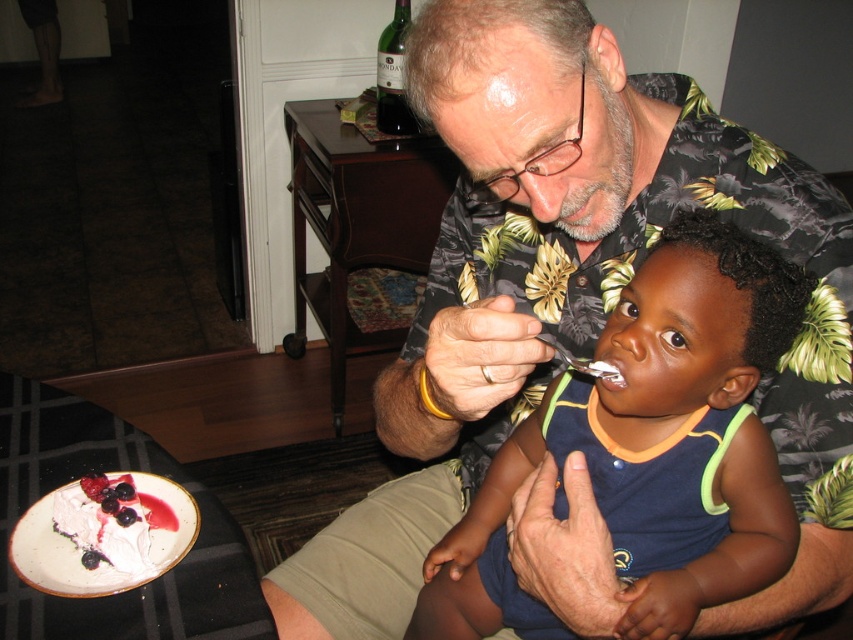
You are standing in front of a scene where an older man is feeding a child wearing a matte blue shirt at center. The man is sitting and the child is in his lap. If you want to place a small toy between them so that it is closer to the child than the man, where should you place it?

To place the small toy closer to the child wearing the matte blue shirt at center than the man, you should position it near the matte blue shirt at center.

You are a photographer taking a picture of the scene. The focus point is set to point (572, 298). Based on the scene description, what object is the focus point on?

The focus point at point (572, 298) is on the floral shirt at center.

What is the color of the shirt worn by the person at the coordinates point (648, 449)?

The color of the shirt at point (648, 449) is matte blue.